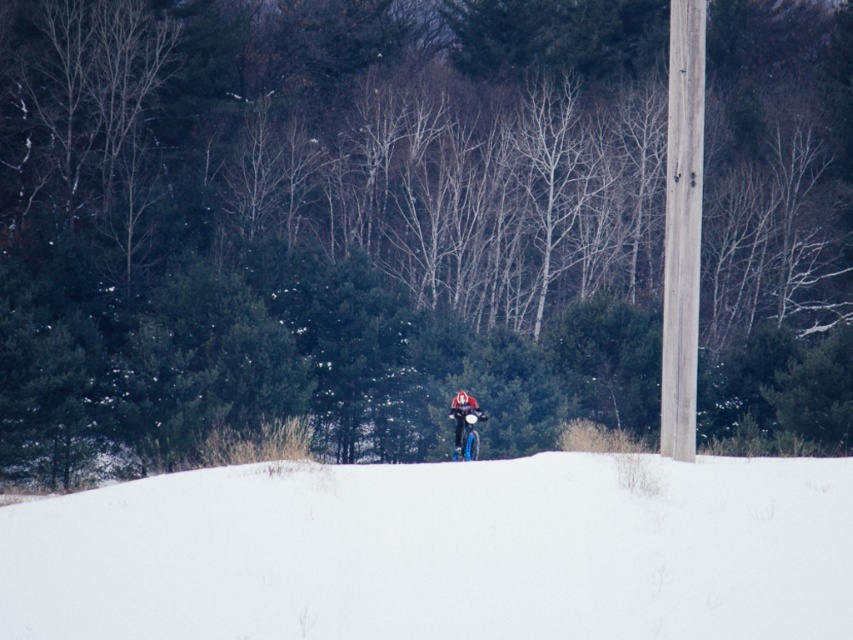
Question: Among these objects, which one is nearest to the camera?

Choices:
 (A) shiny blue snowboard at center
 (B) concrete pole at right

Answer: (B)

Question: Can you confirm if concrete pole at right is wider than shiny blue snowboard at center?

Choices:
 (A) yes
 (B) no

Answer: (A)

Question: Can you confirm if concrete pole at right is bigger than shiny blue snowboard at center?

Choices:
 (A) yes
 (B) no

Answer: (A)

Question: Which object is closer to the camera taking this photo?

Choices:
 (A) concrete pole at right
 (B) white snow at center
 (C) shiny blue snowboard at center

Answer: (B)

Question: Does white snow at center appear on the left side of shiny blue snowboard at center?

Choices:
 (A) no
 (B) yes

Answer: (B)

Question: Which point appears closest to the camera in this image?

Choices:
 (A) 669,305
 (B) 714,461
 (C) 459,444

Answer: (B)